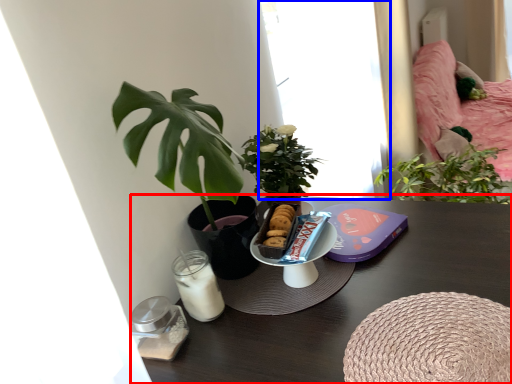
Question: Which object is further to the camera taking this photo, table (highlighted by a red box) or window (highlighted by a blue box)?

Choices:
 (A) table
 (B) window

Answer: (B)